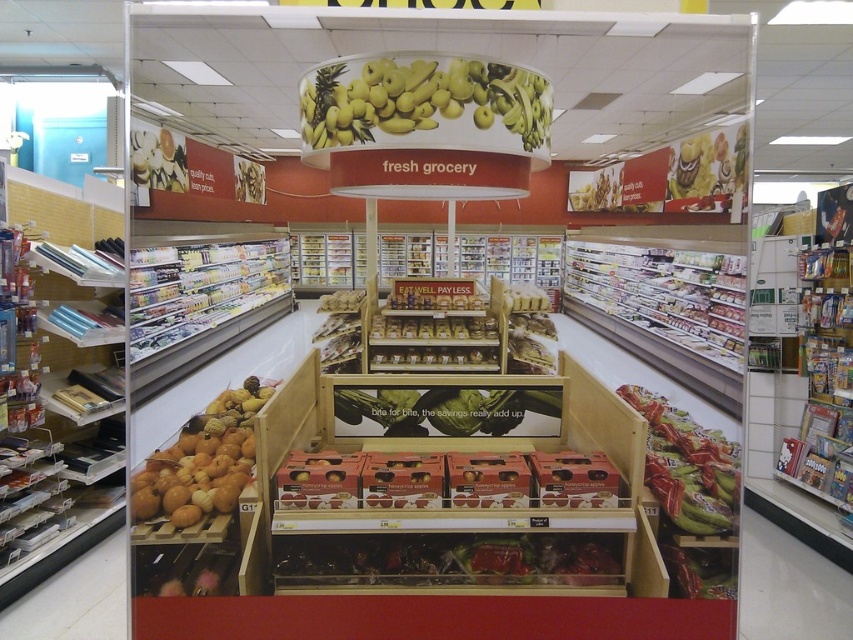
Question: Observing the image, what is the correct spatial positioning of yellow matte bananas at upper center in reference to metallic silver fruit at center?

Choices:
 (A) above
 (B) below

Answer: (A)

Question: Estimate the real-world distances between objects in this image. Which object is farther from the green matte bag at right?

Choices:
 (A) metallic silver books at left
 (B) matte brown wooden crate at center

Answer: (A)

Question: Is metallic silver fruit at center below green matte bag at right?

Choices:
 (A) no
 (B) yes

Answer: (A)

Question: Which point is closer to the camera taking this photo?

Choices:
 (A) (50, 486)
 (B) (537, 435)

Answer: (B)

Question: Which object is positioned closest to the shiny dark chocolate at center?

Choices:
 (A) metallic silver fruit at center
 (B) metallic silver shelf at center

Answer: (B)

Question: Is metallic silver books at left wider than green matte bag at right?

Choices:
 (A) no
 (B) yes

Answer: (B)